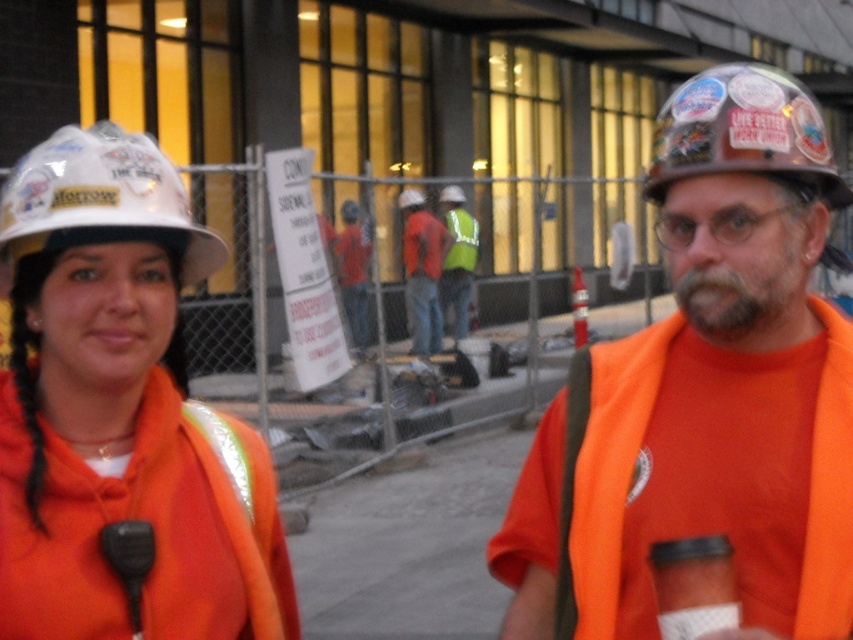
Which is below, matte white hard hat at upper left or orange fabric safety vest at right?

orange fabric safety vest at right is below.

Is matte white hard hat at upper left below orange fabric safety vest at right?

Incorrect, matte white hard hat at upper left is not positioned below orange fabric safety vest at right.

Is point (102, 570) positioned after point (639, 419)?

No, it is not.

Locate an element on the screen. The height and width of the screenshot is (640, 853). matte white hard hat at upper left is located at coordinates (120, 416).

Does orange fabric safety vest at right appear under red reflective vest at center?

Correct, orange fabric safety vest at right is located below red reflective vest at center.

Is orange fabric safety vest at right positioned behind red reflective vest at center?

That is False.

Is point (808, 577) closer to viewer compared to point (357, 218)?

Yes, point (808, 577) is in front of point (357, 218).

You are a GUI agent. You are given a task and a screenshot of the screen. Output one action in this format:
    pyautogui.click(x=<x>, y=<y>)
    Task: Click on the orange fabric safety vest at right
    The image size is (853, 640).
    Given the screenshot: What is the action you would take?
    pyautogui.click(x=611, y=465)

In the scene shown: Is stickered brown hard hat at center smaller than reflective yellow vest at center?

No.

Between stickered brown hard hat at center and reflective yellow vest at center, which one appears on the right side from the viewer's perspective?

From the viewer's perspective, stickered brown hard hat at center appears more on the right side.

Between point (798, 100) and point (456, 310), which one is positioned behind?

Point (456, 310)

Where is `stickered brown hard hat at center`? This screenshot has height=640, width=853. stickered brown hard hat at center is located at coordinates (743, 131).